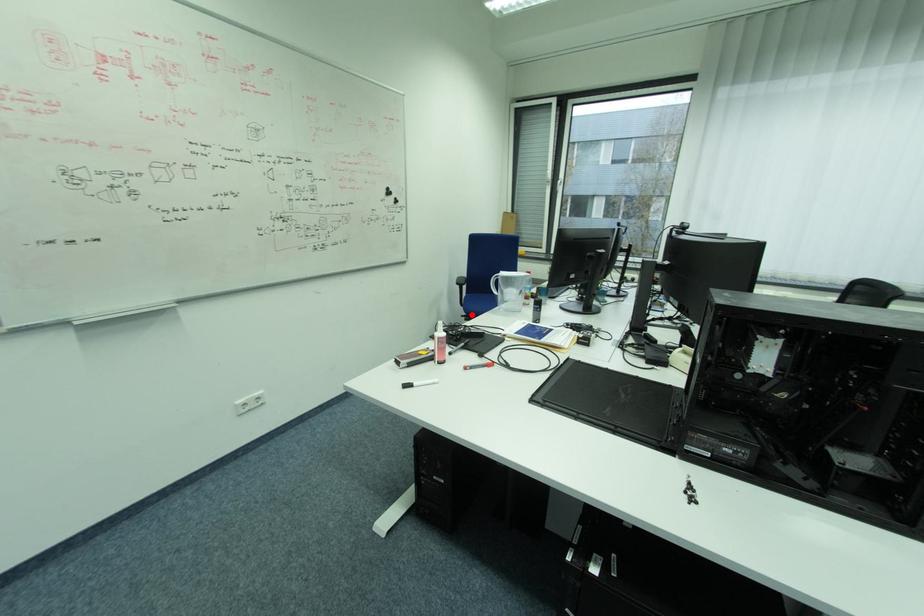
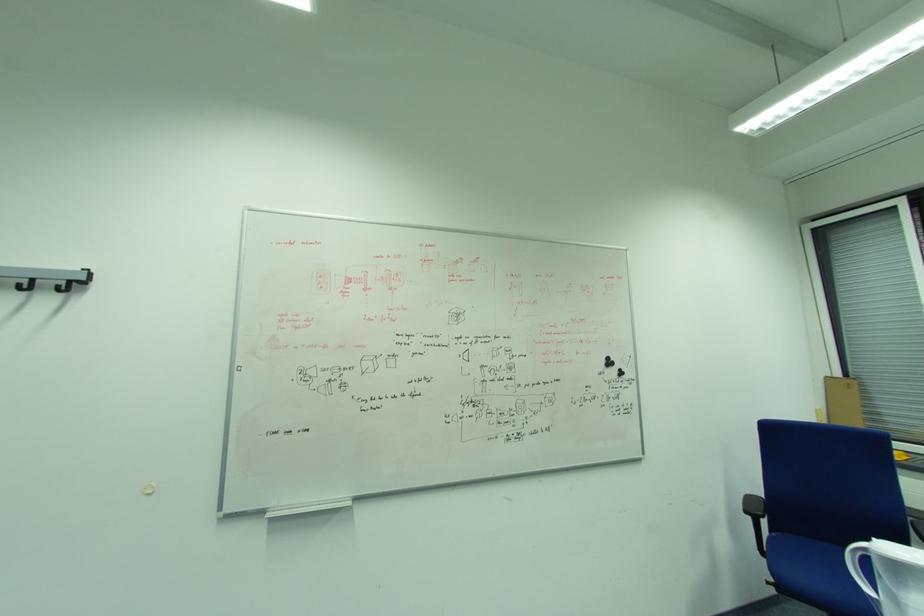
Question: A red point is marked in image1. In image2, is the corresponding 3D point closer to the camera or farther? Reply with the corresponding letter.

Choices:
 (A) The corresponding 3D point is closer.
 (B) The corresponding 3D point is farther.

Answer: (B)